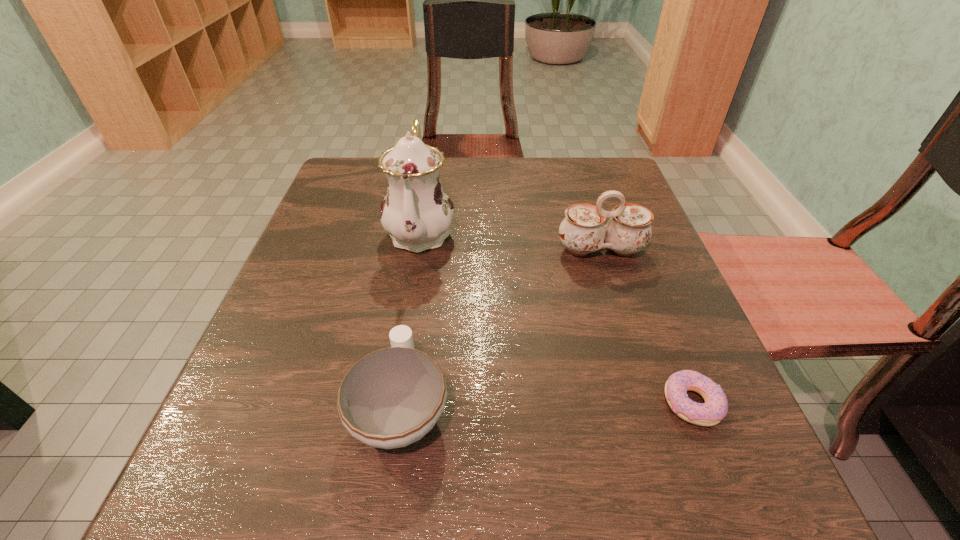
Identify the location of the tallest chinaware. This screenshot has width=960, height=540. (417, 213).

The width and height of the screenshot is (960, 540). Identify the location of the rightmost chinaware. (582, 231).

You are a GUI agent. You are given a task and a screenshot of the screen. Output one action in this format:
    pyautogui.click(x=<x>, y=<y>)
    Task: Click on the second tallest object
    Image resolution: width=960 pixels, height=540 pixels.
    Given the screenshot: What is the action you would take?
    [x=582, y=231]

Locate an element on the screen. Image resolution: width=960 pixels, height=540 pixels. the third tallest object is located at coordinates pos(391,398).

I want to click on the nearest chinaware, so click(x=391, y=398).

I want to click on the shortest object, so click(710, 413).

Where is `vacant space located on the right of the tallest object`? The height and width of the screenshot is (540, 960). vacant space located on the right of the tallest object is located at coordinates (592, 232).

The height and width of the screenshot is (540, 960). In order to click on vacant area located 0.170m by the handle of the second tallest chinaware in this screenshot , I will do pos(626,331).

Find the location of a particular element. This screenshot has width=960, height=540. vacant region located 0.270m on the side with the handle of the nearest chinaware is located at coordinates (423, 249).

Find the location of a particular element. The height and width of the screenshot is (540, 960). vacant region located on the side with the handle of the nearest chinaware is located at coordinates (420, 279).